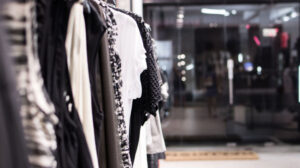
Locate an element on the screen. This screenshot has width=300, height=168. door mat is located at coordinates (210, 156).